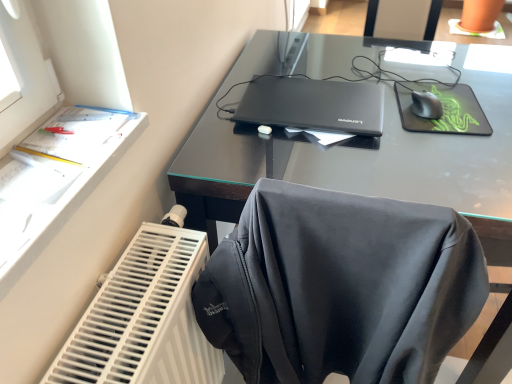
Image resolution: width=512 pixels, height=384 pixels. I want to click on vacant space in front of black matte laptop at center, so click(336, 159).